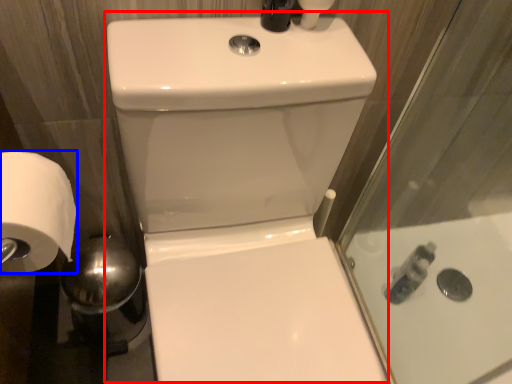
Question: Which point is closer to the camera, sink (highlighted by a red box) or toilet paper (highlighted by a blue box)?

Choices:
 (A) sink
 (B) toilet paper

Answer: (A)